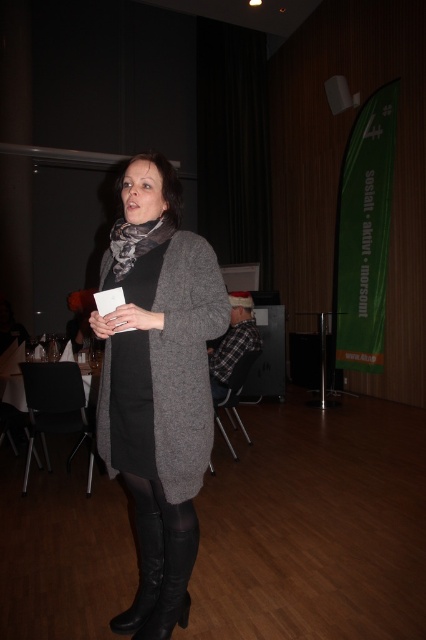
Question: Which point is closer to the camera?

Choices:
 (A) black leather boot at lower center
 (B) black leather boot at lower left
 (C) black matte dress at center

Answer: (C)

Question: Which is farther from the black matte dress at center?

Choices:
 (A) matte gray cardigan at center
 (B) black leather boot at lower center
 (C) black leather boot at lower left
 (D) patterned fabric scarf at center

Answer: (C)

Question: Is black leather boot at lower center closer to camera compared to patterned fabric scarf at center?

Choices:
 (A) no
 (B) yes

Answer: (A)

Question: Which of the following is the closest to the observer?

Choices:
 (A) black matte dress at center
 (B) black leather boot at lower center
 (C) black leather boot at lower left
 (D) matte gray cardigan at center

Answer: (D)

Question: Can you confirm if black matte dress at center is thinner than black leather boot at lower center?

Choices:
 (A) yes
 (B) no

Answer: (B)

Question: Does black matte dress at center appear over patterned fabric scarf at center?

Choices:
 (A) yes
 (B) no

Answer: (B)